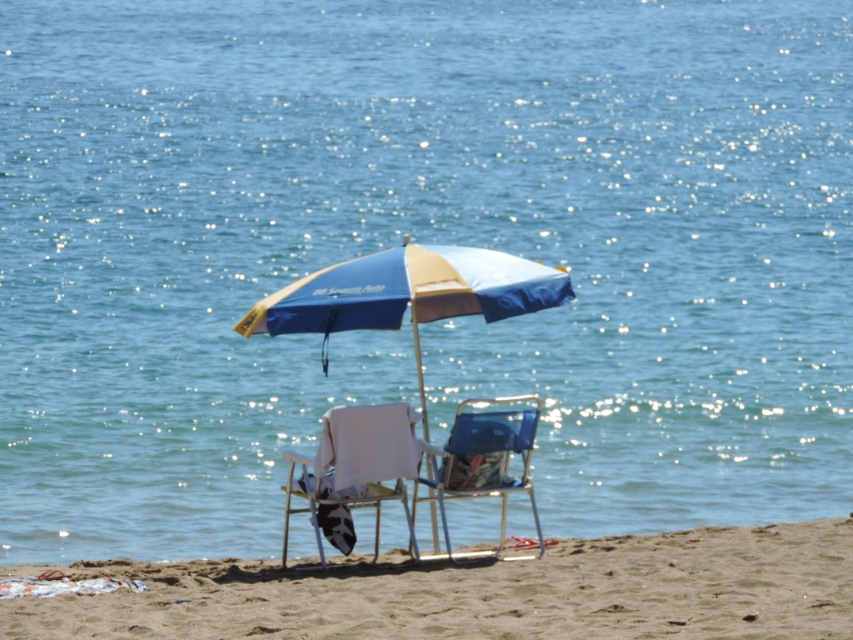
Is point (403, 493) closer to viewer compared to point (447, 540)?

No, it is behind (447, 540).

Who is more forward, (315, 497) or (531, 410)?

Point (315, 497)

Measure the distance between point (344, 468) and camera.

The distance of point (344, 468) from camera is 14.39 meters.

This screenshot has width=853, height=640. I want to click on white fabric chair at center, so click(358, 461).

Can you confirm if sandy brown at lower center is taller than blue fabric umbrella at center?

In fact, sandy brown at lower center may be shorter than blue fabric umbrella at center.

Measure the distance between sandy brown at lower center and camera.

sandy brown at lower center is 11.78 meters away from camera.

Find the location of a particular element. sandy brown at lower center is located at coordinates (479, 592).

From the picture: Can you confirm if blue fabric umbrella at center is bigger than blue fabric chair at center?

Indeed, blue fabric umbrella at center has a larger size compared to blue fabric chair at center.

Consider the image. Which of these two, blue fabric umbrella at center or blue fabric chair at center, stands taller?

With more height is blue fabric umbrella at center.

Where is `blue fabric umbrella at center`? The width and height of the screenshot is (853, 640). blue fabric umbrella at center is located at coordinates (408, 292).